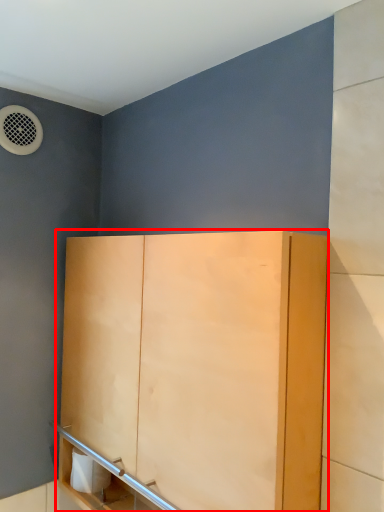
Question: In this image, where is cupboard (annotated by the red box) located relative to toilet paper?

Choices:
 (A) left
 (B) right

Answer: (B)